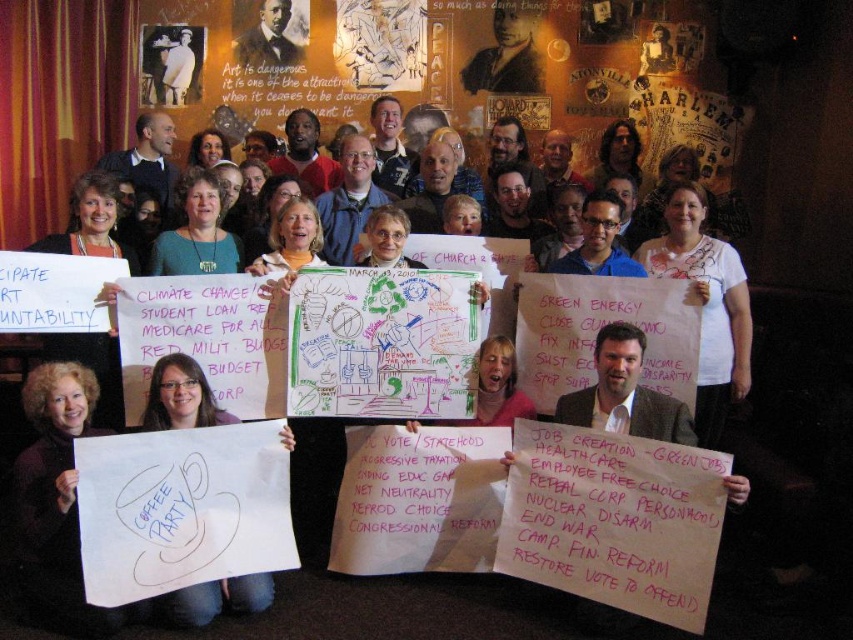
Can you confirm if white paper at lower left is taller than smooth black suit at upper center?

Incorrect, white paper at lower left's height is not larger of smooth black suit at upper center's.

Who is more forward, (x=192, y=595) or (x=245, y=33)?

Point (x=192, y=595) is more forward.

Find the location of a particular element. white paper at lower left is located at coordinates (x=180, y=396).

Does white paper at center appear over smooth black suit at upper center?

Incorrect, white paper at center is not positioned above smooth black suit at upper center.

Is white paper at center shorter than smooth black suit at upper center?

Yes.

Based on the photo, who is more forward, (x=502, y=284) or (x=299, y=60)?

Point (x=502, y=284) is more forward.

Where is `white paper at center`? Image resolution: width=853 pixels, height=640 pixels. white paper at center is located at coordinates (405, 228).

Is point (144, 410) closer to camera compared to point (505, 49)?

Yes, point (144, 410) is closer to viewer.

Is point (247, 577) farther from camera compared to point (515, 84)?

No.

You are a GUI agent. You are given a task and a screenshot of the screen. Output one action in this format:
    pyautogui.click(x=<x>, y=<y>)
    Task: Click on the white paper at lower left
    The height and width of the screenshot is (640, 853).
    Given the screenshot: What is the action you would take?
    pyautogui.click(x=180, y=396)